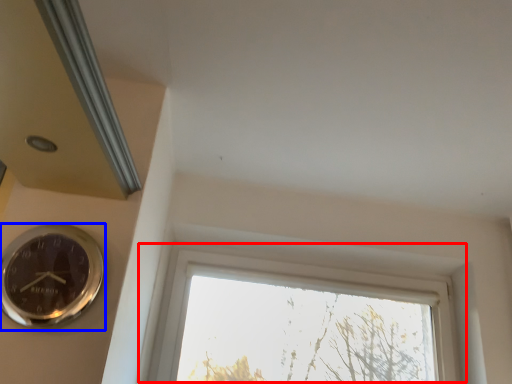
Question: Which of the following is the farthest to the observer, window (highlighted by a red box) or wall clock (highlighted by a blue box)?

Choices:
 (A) window
 (B) wall clock

Answer: (A)